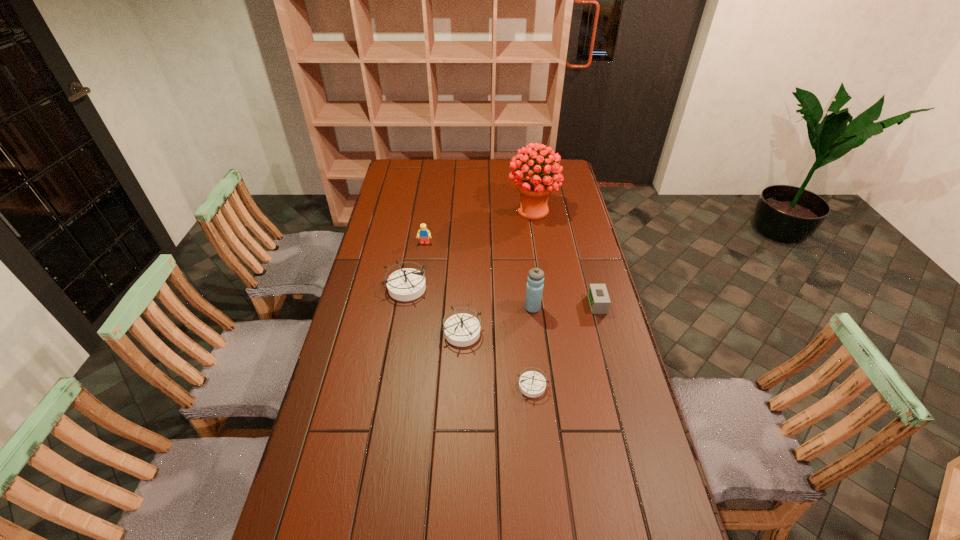
This screenshot has width=960, height=540. I want to click on vacant space that satisfies the following two spatial constraints: 1. on the back side of the water bottle; 2. on the left side of the shortest compass, so click(524, 308).

Identify the location of vacant space that satisfies the following two spatial constraints: 1. on the front-facing side of the sixth nearest object; 2. on the left side of the second nearest object. The image size is (960, 540). (412, 332).

You are a GUI agent. You are given a task and a screenshot of the screen. Output one action in this format:
    pyautogui.click(x=<x>, y=<y>)
    Task: Click on the vacant region that satisfies the following two spatial constraints: 1. on the front-facing side of the Lego; 2. on the left side of the nearest compass
    The image size is (960, 540).
    Given the screenshot: What is the action you would take?
    click(404, 385)